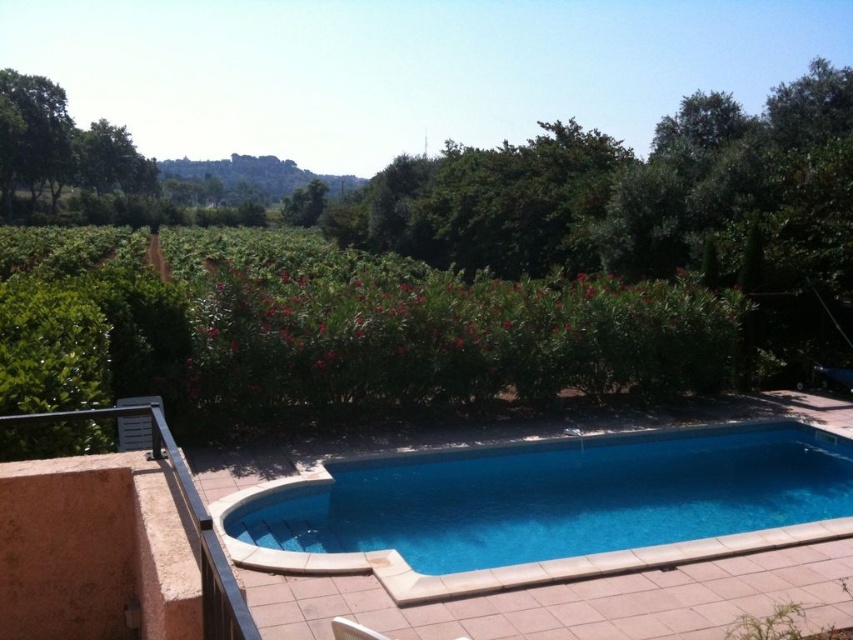
Question: Which object appears farthest from the camera in this image?

Choices:
 (A) green leafy hedge at center
 (B) blue smooth pool at center
 (C) green leafy tree at upper center
 (D) green leafy tree at upper left

Answer: (C)

Question: Does green leafy hedge at center have a smaller size compared to green leafy tree at upper center?

Choices:
 (A) yes
 (B) no

Answer: (B)

Question: Which object appears closest to the camera in this image?

Choices:
 (A) green leafy tree at upper left
 (B) green leafy tree at upper center
 (C) blue smooth pool at center
 (D) green leafy hedge at center

Answer: (D)

Question: Is blue smooth pool at center positioned at the back of green leafy tree at upper left?

Choices:
 (A) no
 (B) yes

Answer: (A)

Question: Which is farther from the green leafy tree at upper center?

Choices:
 (A) blue smooth pool at center
 (B) green leafy hedge at center

Answer: (A)

Question: Is blue smooth pool at center positioned in front of green leafy tree at upper center?

Choices:
 (A) yes
 (B) no

Answer: (A)